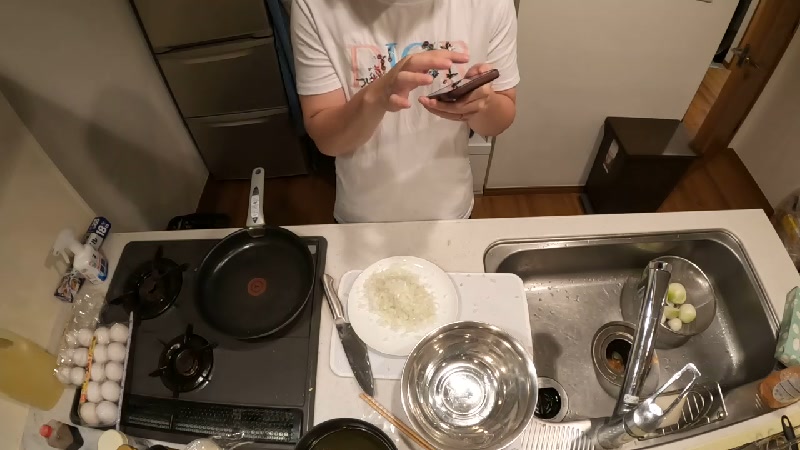
Find the location of a particular element. stove is located at coordinates (264, 373).